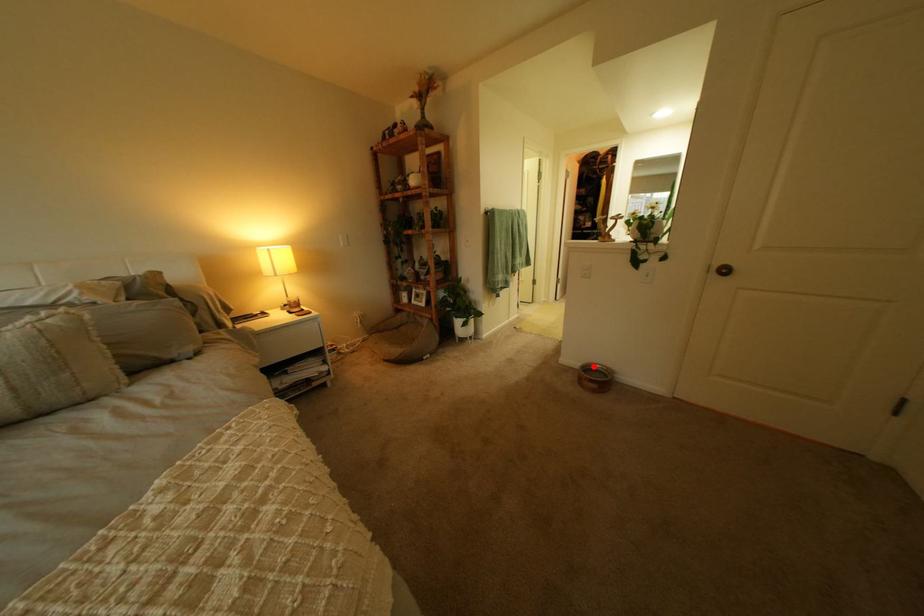
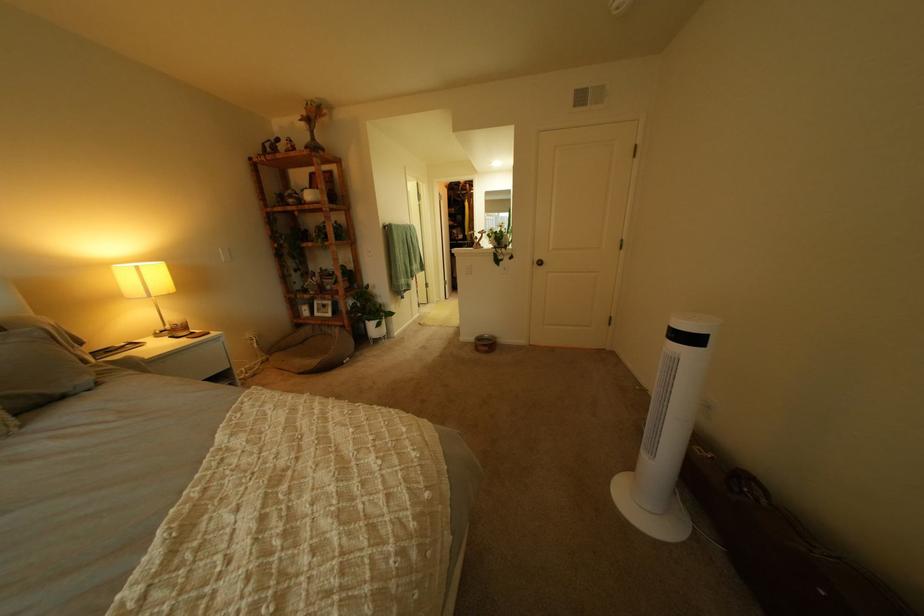
Find the pixel in the second image that matches the highlighted location in the first image.

(489, 339)